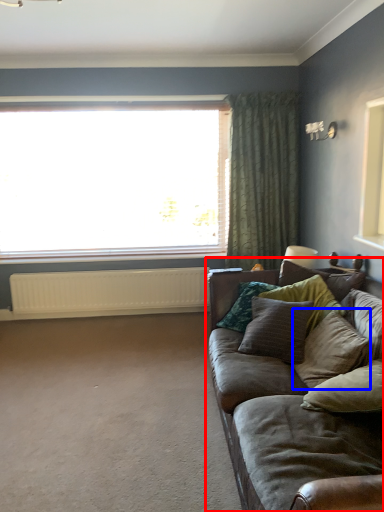
Question: Which point is further to the camera, studio couch (highlighted by a red box) or pillow (highlighted by a blue box)?

Choices:
 (A) studio couch
 (B) pillow

Answer: (B)